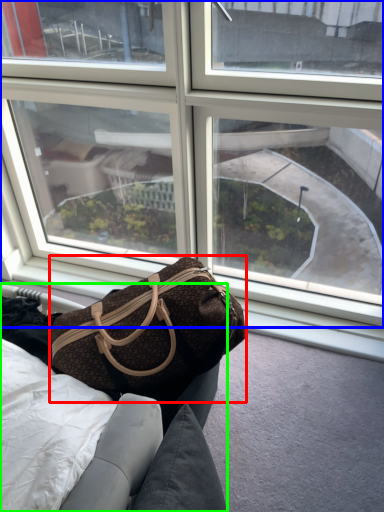
Question: Which object is positioned closest to handbag (highlighted by a red box)? Select from window (highlighted by a blue box) and furniture (highlighted by a green box).

Choices:
 (A) window
 (B) furniture

Answer: (B)